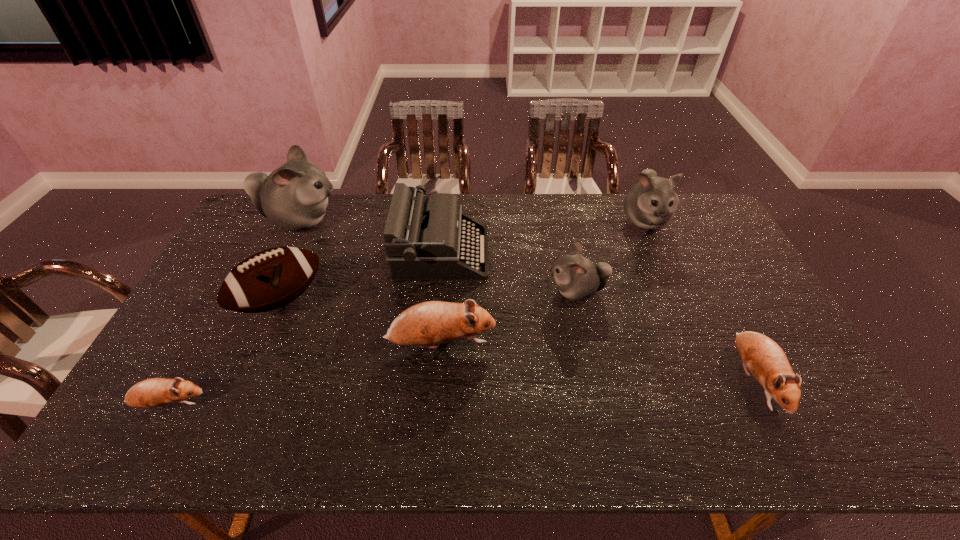
Locate an element on the screen. the leftmost white hamster is located at coordinates (294, 197).

Image resolution: width=960 pixels, height=540 pixels. Identify the location of the tallest hamster. pyautogui.click(x=294, y=197).

Locate an element on the screen. The width and height of the screenshot is (960, 540). the second smallest white hamster is located at coordinates (651, 203).

This screenshot has height=540, width=960. Identify the location of the rightmost white hamster. 651,203.

What are the coordinates of `typewriter` in the screenshot? It's located at coord(423,241).

Where is `football (American)`? This screenshot has height=540, width=960. football (American) is located at coordinates (270, 279).

The width and height of the screenshot is (960, 540). Find the location of `the smallest white hamster`. the smallest white hamster is located at coordinates (577, 278).

The width and height of the screenshot is (960, 540). I want to click on the third farthest hamster, so click(577, 278).

Find the location of a particular element. the third hamster from left to right is located at coordinates (432, 322).

At what (x,y) coordinates should I click in order to perform the action: click on the second brown hamster from right to left. Please return your answer as a coordinate pair (x, y). This screenshot has width=960, height=540. Looking at the image, I should click on (432, 322).